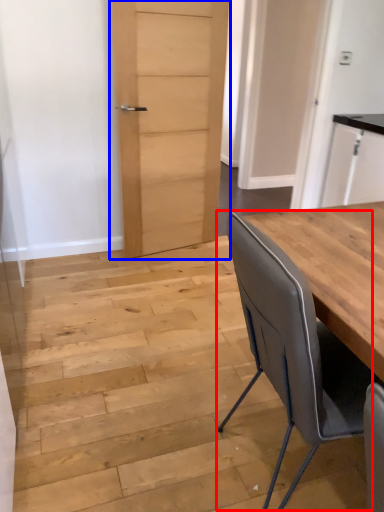
Question: Among these objects, which one is nearest to the camera, chair (highlighted by a red box) or door (highlighted by a blue box)?

Choices:
 (A) chair
 (B) door

Answer: (A)